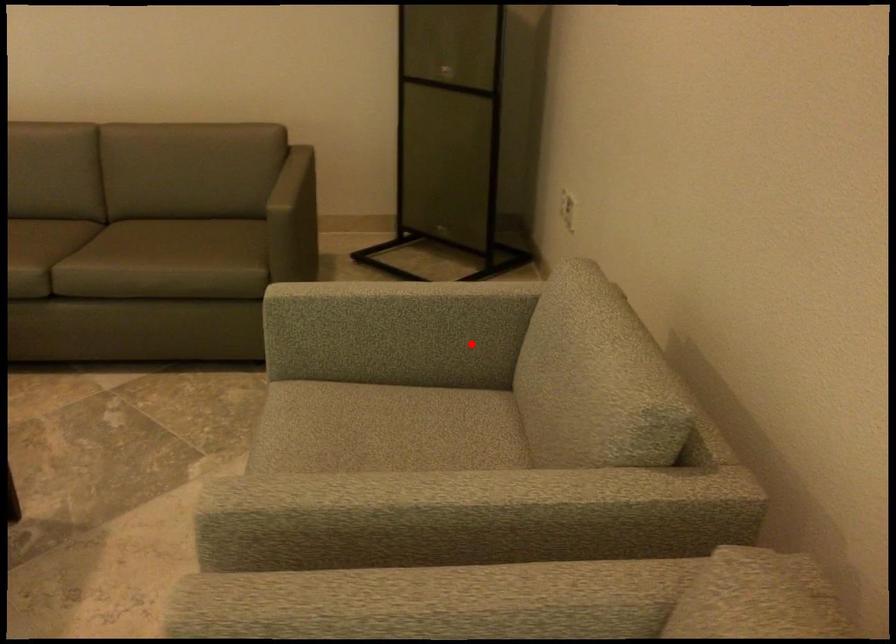
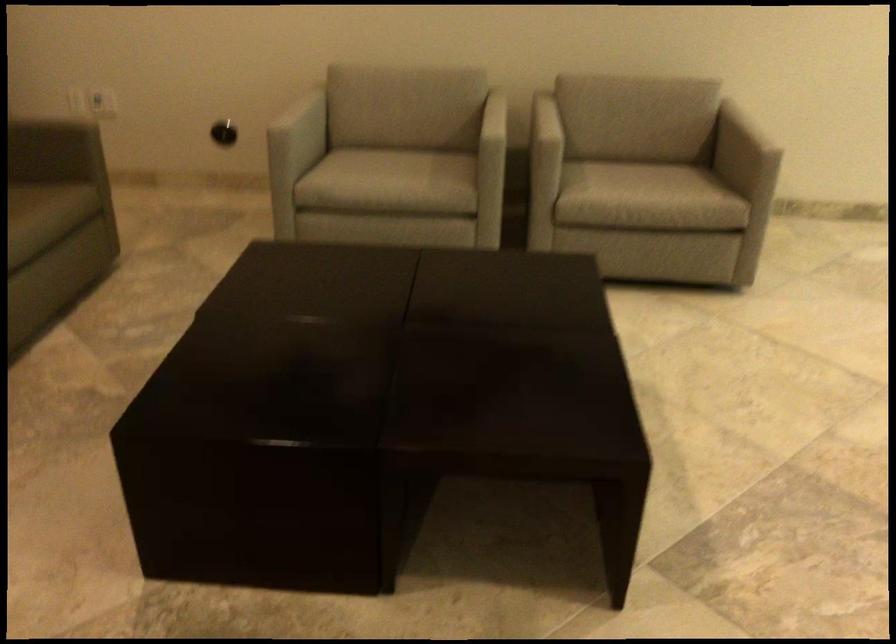
Locate, in the second image, the point that corresponds to the highlighted location in the first image.

(304, 124)